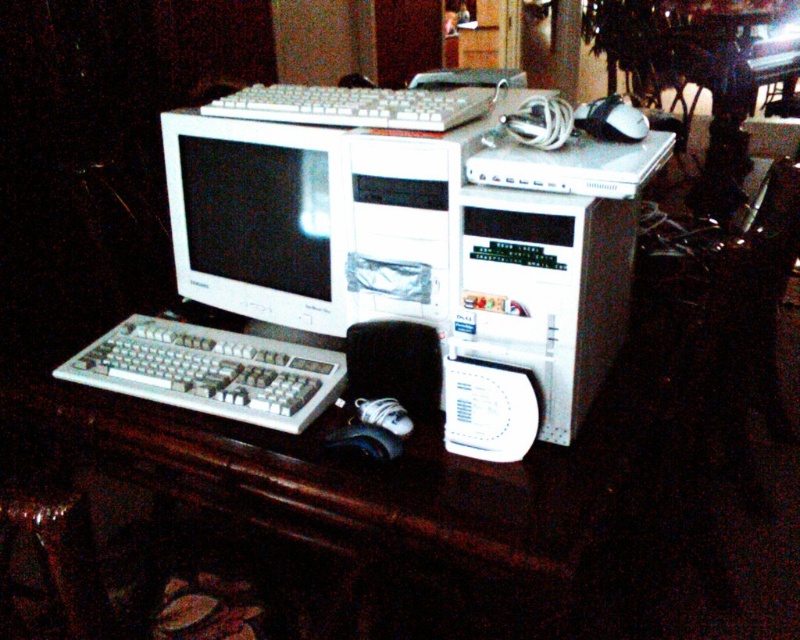
Question: Which object is farther from the camera taking this photo?

Choices:
 (A) white glossy monitor at center
 (B) white plastic keyboard at lower left
 (C) white plastic keyboard at center

Answer: (A)

Question: Is white glossy monitor at center thinner than white plastic keyboard at lower left?

Choices:
 (A) yes
 (B) no

Answer: (A)

Question: Which point is farther to the camera?

Choices:
 (A) white plastic computer tower at center
 (B) black rubber mouse at lower center
 (C) white glossy monitor at center
 (D) white plastic keyboard at center

Answer: (C)

Question: Is white plastic computer tower at center above black rubber mouse at lower center?

Choices:
 (A) yes
 (B) no

Answer: (A)

Question: Is white glossy monitor at center positioned in front of white plastic keyboard at lower left?

Choices:
 (A) no
 (B) yes

Answer: (A)

Question: Which is farther from the white glossy monitor at center?

Choices:
 (A) white plastic keyboard at center
 (B) white plastic keyboard at lower left
 (C) black rubber mouse at lower center

Answer: (C)